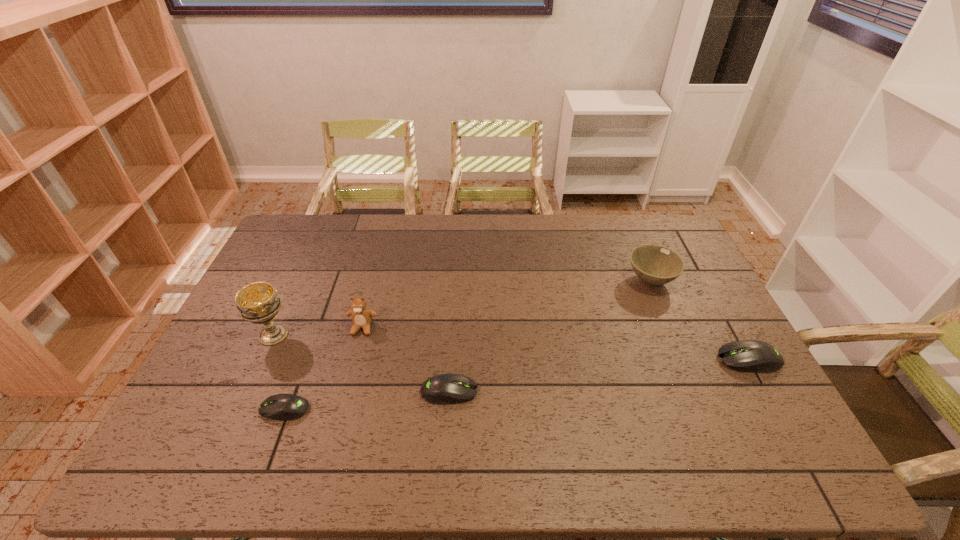
I want to click on vacant area between the farthest computer mouse and the second shortest object, so click(x=599, y=375).

What are the coordinates of `unoccupied area between the tallest object and the teddy bear` in the screenshot? It's located at (318, 331).

Image resolution: width=960 pixels, height=540 pixels. I want to click on empty space between the third tallest object and the leftmost computer mouse, so click(x=468, y=345).

Find the location of `empty space that is in between the tallest object and the fifth shortest object`. empty space that is in between the tallest object and the fifth shortest object is located at coordinates (318, 331).

What are the coordinates of `vacant region between the third object from left to right and the tallest object` in the screenshot? It's located at (318, 331).

I want to click on free space that is in between the shortest object and the rightmost computer mouse, so click(516, 384).

Image resolution: width=960 pixels, height=540 pixels. I want to click on the fifth closest object to the shortest computer mouse, so click(753, 356).

Identify the location of the second closest object relative to the shortest object. (361, 316).

The width and height of the screenshot is (960, 540). Identify the location of computer mouse identified as the third closest to the farthest object. (283, 407).

Find the location of a particular element. Image resolution: width=960 pixels, height=540 pixels. computer mouse object that ranks as the closest to the teddy bear is located at coordinates (283, 407).